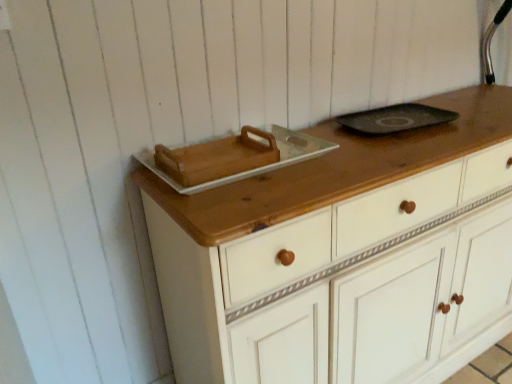
Where is `vacant region to the right of wooden tray at upper center`? vacant region to the right of wooden tray at upper center is located at coordinates (353, 150).